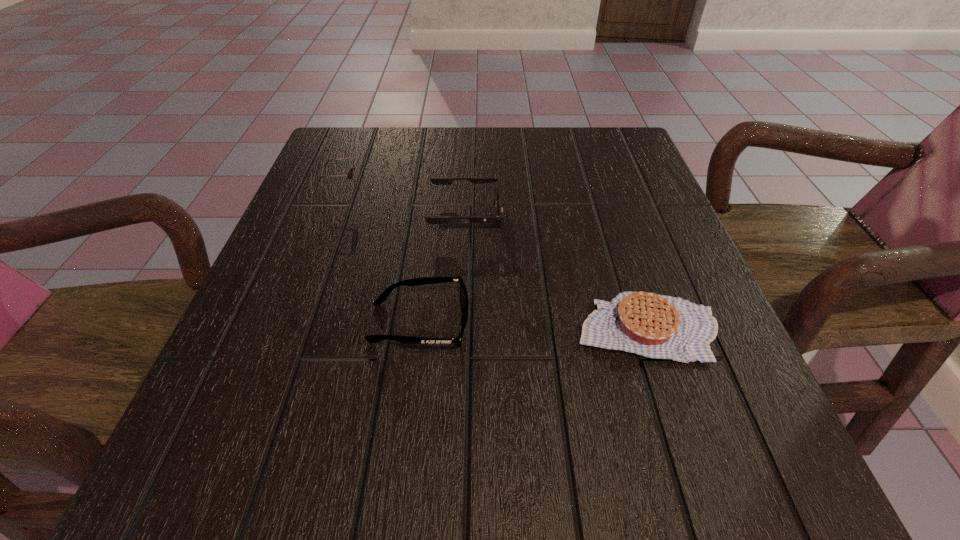
Find the location of a particular element. Image resolution: width=960 pixels, height=540 pixels. object located in the right edge section of the desktop is located at coordinates (656, 326).

You are a GUI agent. You are given a task and a screenshot of the screen. Output one action in this format:
    pyautogui.click(x=<x>, y=<y>)
    Task: Click on the object positioned at the far left corner
    
    Given the screenshot: What is the action you would take?
    pyautogui.click(x=349, y=174)

In the image, there is a desktop. At what (x,y) coordinates should I click in order to perform the action: click on vacant space at the far edge. Please return your answer as a coordinate pair (x, y). Looking at the image, I should click on (522, 138).

Locate an element on the screen. This screenshot has height=540, width=960. free location at the near edge of the desktop is located at coordinates (619, 451).

Where is `free location at the left edge`? The image size is (960, 540). free location at the left edge is located at coordinates (296, 347).

The height and width of the screenshot is (540, 960). What are the coordinates of `free space at the right edge` in the screenshot? It's located at (651, 218).

In the image, there is a desktop. At what (x,y) coordinates should I click in order to perform the action: click on vacant region at the far right corner. Please return your answer as a coordinate pair (x, y). The image size is (960, 540). Looking at the image, I should click on (619, 157).

Locate an element on the screen. Image resolution: width=960 pixels, height=540 pixels. empty space that is in between the nearest sunglasses and the shortest object is located at coordinates (533, 325).

Locate an element on the screen. This screenshot has width=960, height=540. unoccupied area between the tallest sunglasses and the rightmost object is located at coordinates (494, 259).

Find the location of a particular element. empty space that is in between the nearest sunglasses and the tallest object is located at coordinates (381, 256).